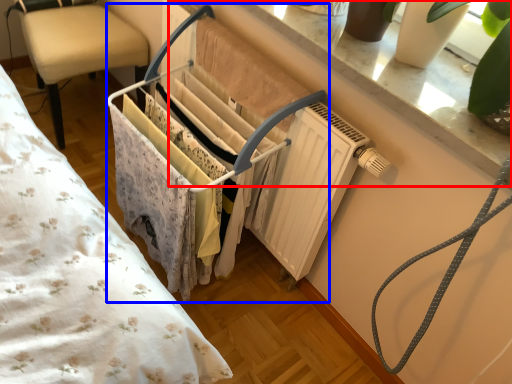
Question: Which of the following is the closest to the observer, window sill (highlighted by a red box) or closet (highlighted by a blue box)?

Choices:
 (A) window sill
 (B) closet

Answer: (A)